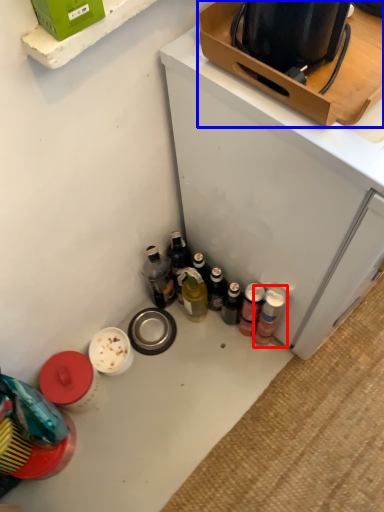
Question: Among these objects, which one is farthest to the camera, bottle (highlighted by a red box) or box (highlighted by a blue box)?

Choices:
 (A) bottle
 (B) box

Answer: (A)